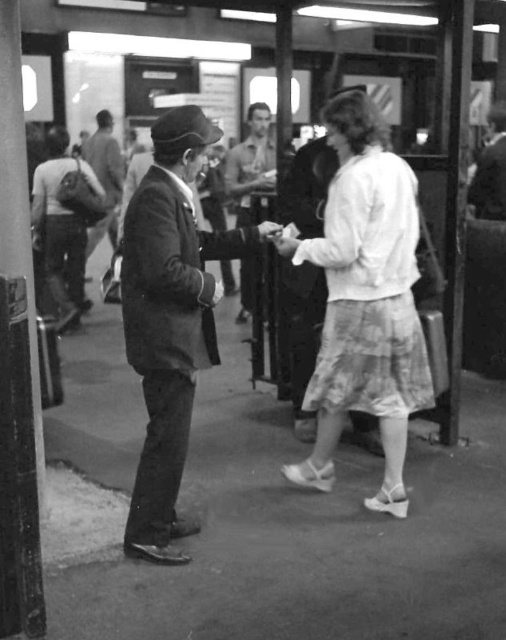
Is point (249, 168) farther from camera compared to point (91, 227)?

No, it is not.

Is smooth leather jacket at center behind smooth fabric suit at center?

No.

The width and height of the screenshot is (506, 640). What are the coordinates of `smooth leather jacket at center` in the screenshot? It's located at (250, 163).

Does smooth dark suit at left have a greater width compared to smooth leather jacket at center?

Indeed, smooth dark suit at left has a greater width compared to smooth leather jacket at center.

Does smooth dark suit at left have a lesser width compared to smooth leather jacket at center?

No.

Between point (147, 372) and point (224, 180), which one is positioned in front?

Positioned in front is point (147, 372).

I want to click on smooth dark suit at left, so click(171, 317).

Can you confirm if white cotton skirt at center is wider than smooth leather jacket at upper right?

Indeed, white cotton skirt at center has a greater width compared to smooth leather jacket at upper right.

Is point (378, 400) farther from camera compared to point (478, 180)?

No, (378, 400) is closer to viewer.

This screenshot has height=640, width=506. I want to click on white cotton skirt at center, so click(364, 300).